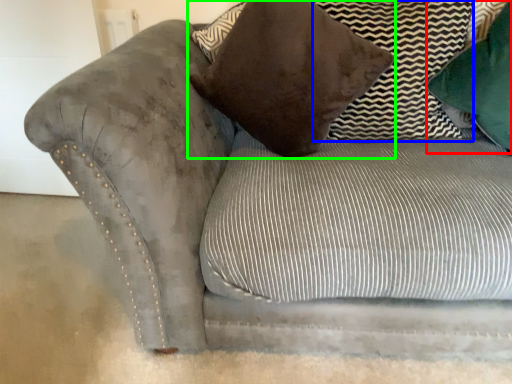
Question: Which object is positioned farthest from pillow (highlighted by a red box)? Select from pillow (highlighted by a blue box) and pillow (highlighted by a green box).

Choices:
 (A) pillow
 (B) pillow

Answer: (B)